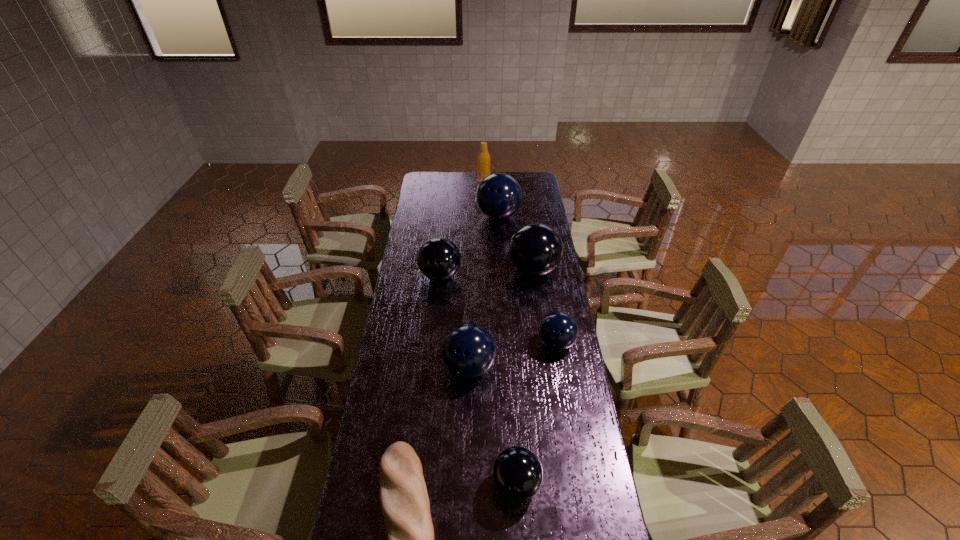
In order to click on free space located 0.260m on the right of the farthest object in this screenshot , I will do `click(534, 181)`.

Locate an element on the screen. The image size is (960, 540). vacant space situated on the surface of the second farthest object near the finger holes is located at coordinates (500, 246).

This screenshot has width=960, height=540. In order to click on free spot located 0.230m on the side of the biggest black bowling ball with the finger holes in this screenshot , I will do `click(458, 271)`.

Where is `vacant region located on the side of the biggest black bowling ball with the finger holes`? The height and width of the screenshot is (540, 960). vacant region located on the side of the biggest black bowling ball with the finger holes is located at coordinates (491, 271).

I want to click on vacant space located on the side of the biggest black bowling ball with the finger holes, so click(x=473, y=271).

You are a GUI agent. You are given a task and a screenshot of the screen. Output one action in this format:
    pyautogui.click(x=<x>, y=<y>)
    Task: Click on the free space located 0.290m on the side of the leftmost black bowling ball with the finger holes
    The width and height of the screenshot is (960, 540).
    Given the screenshot: What is the action you would take?
    pyautogui.click(x=434, y=341)

Where is `free location located 0.270m on the surface of the second smallest blue bowling ball near the finger holes`? The height and width of the screenshot is (540, 960). free location located 0.270m on the surface of the second smallest blue bowling ball near the finger holes is located at coordinates (467, 465).

The image size is (960, 540). Identify the location of vacant space located on the surface of the smallest blue bowling ball near the finger holes. (569, 418).

Find the location of a particular element. The width and height of the screenshot is (960, 540). object situated at the far edge is located at coordinates (483, 159).

The image size is (960, 540). I want to click on object present at the left edge, so click(438, 259).